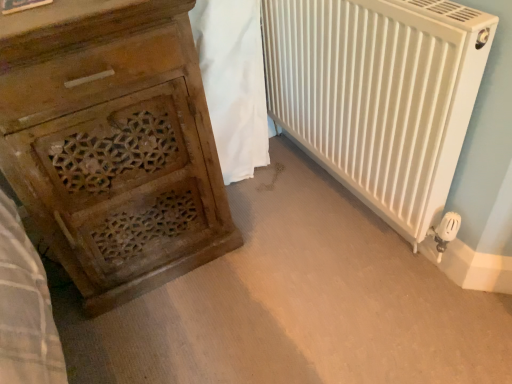
Find the location of `free space in front of wooden carved chest of drawers at left`. free space in front of wooden carved chest of drawers at left is located at coordinates (175, 334).